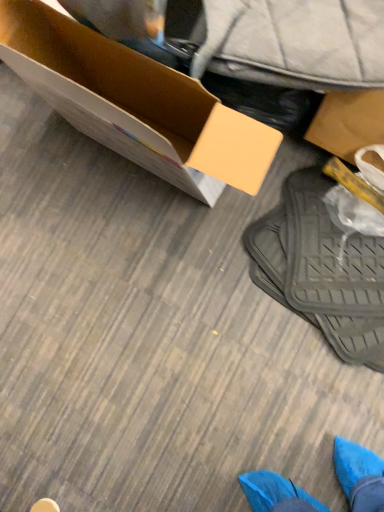
Based on the photo, measure the distance between point (174, 126) and camera.

Point (174, 126) and camera are 3.75 feet apart.

Describe the element at coordinates (321, 269) in the screenshot. I see `black rubber mat at lower right` at that location.

This screenshot has height=512, width=384. I want to click on cardboard box at upper left, so click(x=135, y=104).

Does blue suede shoe at lower left lie behind cardboard box at upper left?

That is True.

In the scene shown: From a real-world perspective, does blue suede shoe at lower left sit lower than cardboard box at upper left?

Yes, from a real-world perspective, blue suede shoe at lower left is below cardboard box at upper left.

Does blue suede shoe at lower left have a lesser height compared to cardboard box at upper left?

Yes.

Based on the photo, in terms of size, does blue suede shoe at lower left appear bigger or smaller than cardboard box at upper left?

Considering their sizes, blue suede shoe at lower left takes up less space than cardboard box at upper left.

Is blue suede shoe at lower left aimed at black rubber mat at lower right?

Yes, blue suede shoe at lower left is facing black rubber mat at lower right.

Are blue suede shoe at lower left and black rubber mat at lower right beside each other?

No, blue suede shoe at lower left is not next to black rubber mat at lower right.

Does point (42, 500) lie in front of point (246, 249)?

Yes.

Considering the sizes of objects blue suede shoe at lower left and black rubber mat at lower right in the image provided, who is wider, blue suede shoe at lower left or black rubber mat at lower right?

With larger width is black rubber mat at lower right.

Who is more distant, black rubber mat at lower right or blue suede shoe at lower left?

blue suede shoe at lower left is further from the camera.

From the image's perspective, is black rubber mat at lower right located beneath blue suede shoe at lower left?

Incorrect, from the image's perspective, black rubber mat at lower right is higher than blue suede shoe at lower left.

Considering the points (338, 331) and (42, 504), which point is in front, point (338, 331) or point (42, 504)?

The point (338, 331) is in front.

Is black rubber mat at lower right wider than blue suede shoe at lower left?

Yes, black rubber mat at lower right is wider than blue suede shoe at lower left.

Looking at their sizes, would you say black rubber mat at lower right is wider or thinner than cardboard box at upper left?

Considering their sizes, black rubber mat at lower right looks broader than cardboard box at upper left.

Between point (375, 313) and point (213, 176), which one is positioned in front?

The point (213, 176) is closer.

Is black rubber mat at lower right bigger than cardboard box at upper left?

No, black rubber mat at lower right is not bigger than cardboard box at upper left.

From the image's perspective, is black rubber mat at lower right under cardboard box at upper left?

Yes, from the image's perspective, black rubber mat at lower right is below cardboard box at upper left.

Can you confirm if cardboard box at upper left is bigger than black rubber mat at lower right?

Yes, cardboard box at upper left is bigger than black rubber mat at lower right.

From the image's perspective, does cardboard box at upper left appear higher than black rubber mat at lower right?

Yes, from the image's perspective, cardboard box at upper left is above black rubber mat at lower right.

Could you tell me if cardboard box at upper left is facing black rubber mat at lower right?

No, cardboard box at upper left is not turned towards black rubber mat at lower right.

Who is shorter, cardboard box at upper left or blue suede shoe at lower left?

With less height is blue suede shoe at lower left.

Which object is positioned more to the right, cardboard box at upper left or blue suede shoe at lower left?

From the viewer's perspective, cardboard box at upper left appears more on the right side.

Is cardboard box at upper left closer to the viewer compared to blue suede shoe at lower left?

Yes, cardboard box at upper left is closer to the camera.

From the picture: From the image's perspective, would you say cardboard box at upper left is shown under blue suede shoe at lower left?

Incorrect, from the image's perspective, cardboard box at upper left is higher than blue suede shoe at lower left.

Locate an element on the screen. The width and height of the screenshot is (384, 512). box above the blue suede shoe at lower left (from a real-world perspective) is located at coordinates (135, 104).

The image size is (384, 512). What are the coordinates of `shoe below the black rubber mat at lower right (from the image's perspective)` in the screenshot? It's located at (45, 506).

Which object lies nearer to the anchor point cardboard box at upper left, blue suede shoe at lower left or black rubber mat at lower right?

The object closer to cardboard box at upper left is black rubber mat at lower right.

From the image, which object appears to be nearer to black rubber mat at lower right, cardboard box at upper left or blue suede shoe at lower left?

Among the two, cardboard box at upper left is located nearer to black rubber mat at lower right.

Which object lies further to the anchor point cardboard box at upper left, black rubber mat at lower right or blue suede shoe at lower left?

blue suede shoe at lower left is further to cardboard box at upper left.

Estimate the real-world distances between objects in this image. Which object is further from blue suede shoe at lower left, cardboard box at upper left or black rubber mat at lower right?

The object further to blue suede shoe at lower left is cardboard box at upper left.

From the image, which object appears to be farther from black rubber mat at lower right, blue suede shoe at lower left or cardboard box at upper left?

Based on the image, blue suede shoe at lower left appears to be further to black rubber mat at lower right.

When comparing their distances from blue suede shoe at lower left, does black rubber mat at lower right or cardboard box at upper left seem further?

Based on the image, cardboard box at upper left appears to be further to blue suede shoe at lower left.

Where is `footwear that lies between cardboard box at upper left and blue suede shoe at lower left from top to bottom`? The height and width of the screenshot is (512, 384). footwear that lies between cardboard box at upper left and blue suede shoe at lower left from top to bottom is located at coordinates (321, 269).